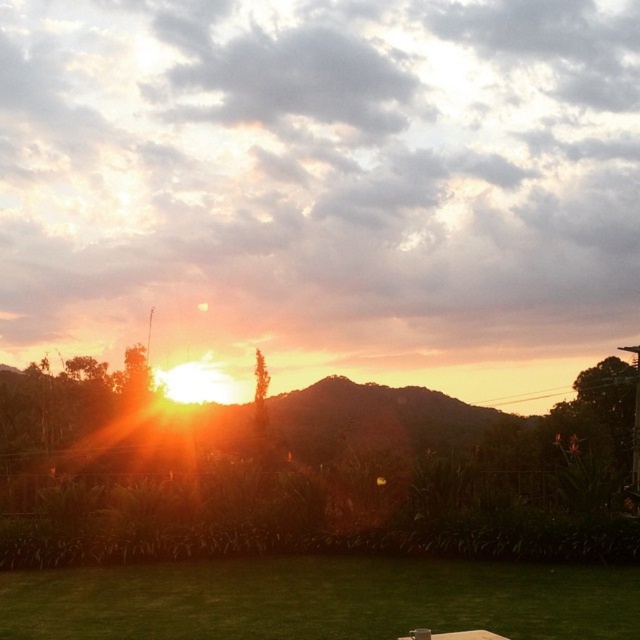
Question: Where is green grass at lower center located in relation to brown wooden picnic table at center in the image?

Choices:
 (A) right
 (B) left

Answer: (B)

Question: Which object is farther from the camera taking this photo?

Choices:
 (A) brown wooden picnic table at center
 (B) green grass at lower center

Answer: (B)

Question: Which object appears closest to the camera in this image?

Choices:
 (A) green grass at lower center
 (B) brown wooden picnic table at center

Answer: (B)

Question: Is the position of green grass at lower center more distant than that of brown wooden picnic table at center?

Choices:
 (A) no
 (B) yes

Answer: (B)

Question: Is green grass at lower center thinner than brown wooden picnic table at center?

Choices:
 (A) yes
 (B) no

Answer: (B)

Question: Among these points, which one is nearest to the camera?

Choices:
 (A) (429, 636)
 (B) (436, 568)

Answer: (A)